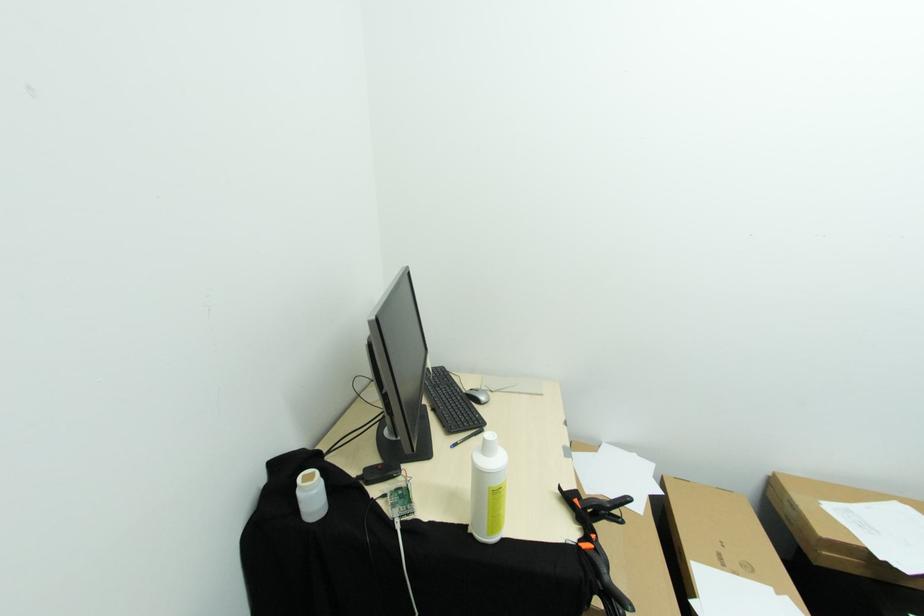
Which object does [488,488] point to?

It refers to a white plastic bottle.